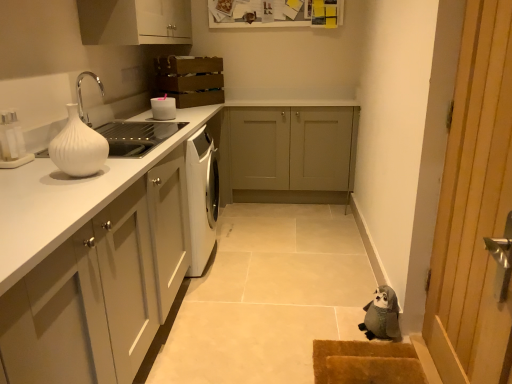
Question: Is brown textured mat at lower right beside gray fabric stuffed animal at lower right?

Choices:
 (A) yes
 (B) no

Answer: (B)

Question: Is brown textured mat at lower right far away from gray fabric stuffed animal at lower right?

Choices:
 (A) no
 (B) yes

Answer: (A)

Question: Can you confirm if brown textured mat at lower right is positioned to the left of gray fabric stuffed animal at lower right?

Choices:
 (A) no
 (B) yes

Answer: (B)

Question: Does brown textured mat at lower right lie in front of gray fabric stuffed animal at lower right?

Choices:
 (A) yes
 (B) no

Answer: (A)

Question: From a real-world perspective, is brown textured mat at lower right on top of gray fabric stuffed animal at lower right?

Choices:
 (A) no
 (B) yes

Answer: (A)

Question: From their relative heights in the image, would you say white matte cabinet at upper center, the second cabinetry in the back-to-front sequence, is taller or shorter than gray fabric stuffed animal at lower right?

Choices:
 (A) tall
 (B) short

Answer: (A)

Question: In the image, is white matte cabinet at upper center, the second cabinetry in the back-to-front sequence, positioned in front of or behind gray fabric stuffed animal at lower right?

Choices:
 (A) front
 (B) behind

Answer: (B)

Question: In terms of size, does white matte cabinet at upper center, the second cabinetry in the back-to-front sequence, appear bigger or smaller than gray fabric stuffed animal at lower right?

Choices:
 (A) big
 (B) small

Answer: (A)

Question: From a real-world perspective, is white matte cabinet at upper center, which is the 2th cabinetry from front to back, positioned above or below gray fabric stuffed animal at lower right?

Choices:
 (A) below
 (B) above

Answer: (B)

Question: Considering their positions, is matte gray cabinet at center, the 3th cabinetry positioned from the front, located in front of or behind white glossy vase at left?

Choices:
 (A) front
 (B) behind

Answer: (B)

Question: In the image, is matte gray cabinet at center, the first cabinetry viewed from the back, on the left side or the right side of white glossy vase at left?

Choices:
 (A) left
 (B) right

Answer: (B)

Question: Considering the positions of point (269, 139) and point (65, 148), is point (269, 139) closer or farther from the camera than point (65, 148)?

Choices:
 (A) closer
 (B) farther

Answer: (B)

Question: From the image's perspective, relative to white glossy vase at left, is matte gray cabinet at center, the first cabinetry viewed from the back, above or below?

Choices:
 (A) below
 (B) above

Answer: (B)

Question: Is point (390, 377) closer or farther from the camera than point (367, 326)?

Choices:
 (A) farther
 (B) closer

Answer: (B)

Question: Based on their positions, is brown textured mat at lower right located to the left or right of gray fabric stuffed animal at lower right?

Choices:
 (A) left
 (B) right

Answer: (A)